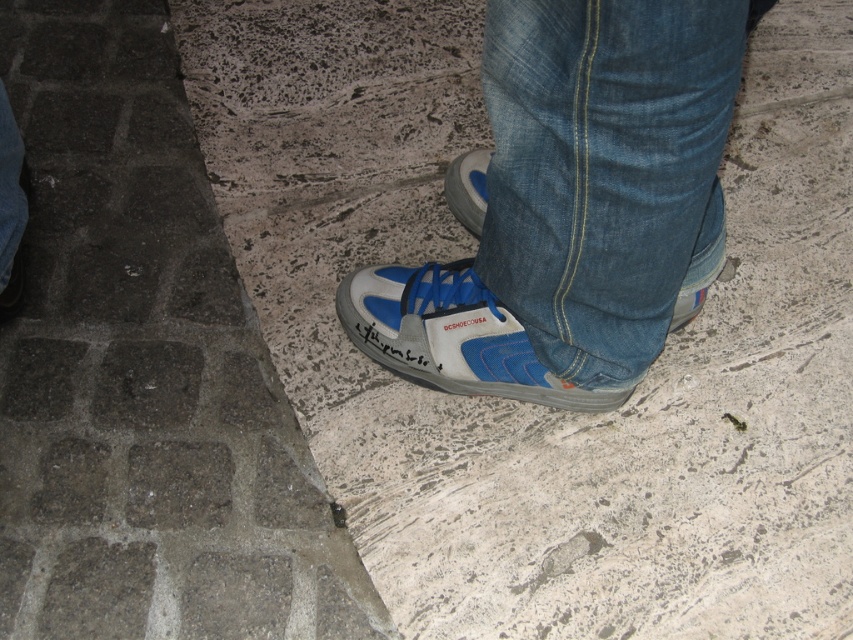
You are standing in front of the person in the image and want to touch the point at coordinates point (210, 525). If your hand can reach up to 1.0 meters, will you be able to reach it?

The point (210, 525) is 1.20 meters away from the camera, which is beyond your hand reach of 1.0 meters. Therefore, you cannot reach it.

You are standing on the ground in the image. If you want to step onto the denim at center, which is represented by point (605, 170), should you move forward or backward?

The denim at center is represented by point (605, 170), so you should move forward to reach it.